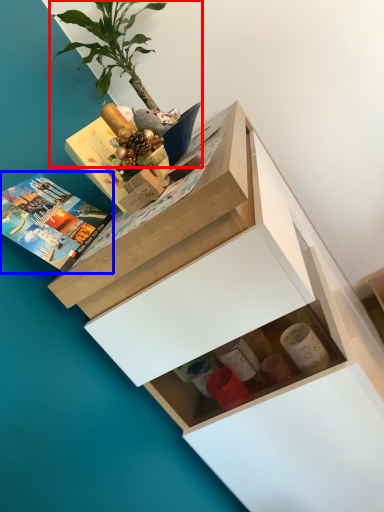
Question: Which point is further to the camera, houseplant (highlighted by a red box) or book (highlighted by a blue box)?

Choices:
 (A) houseplant
 (B) book

Answer: (A)